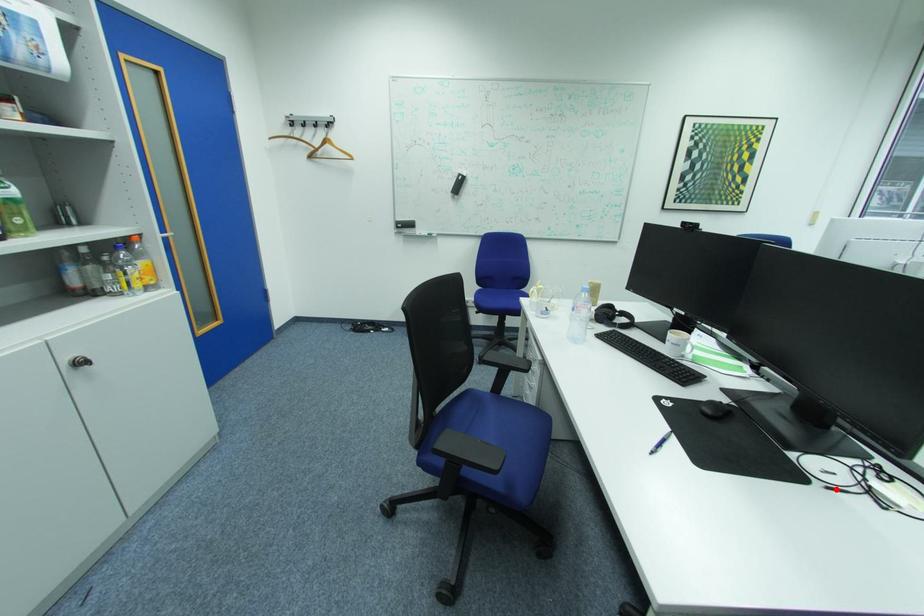
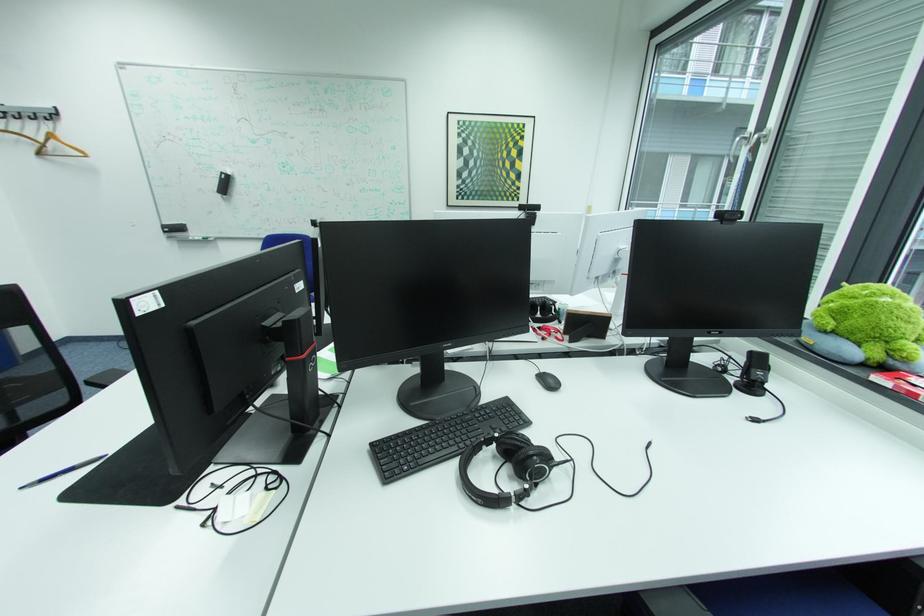
The point at the highlighted location is marked in the first image. Where is the corresponding point in the second image?

(187, 508)